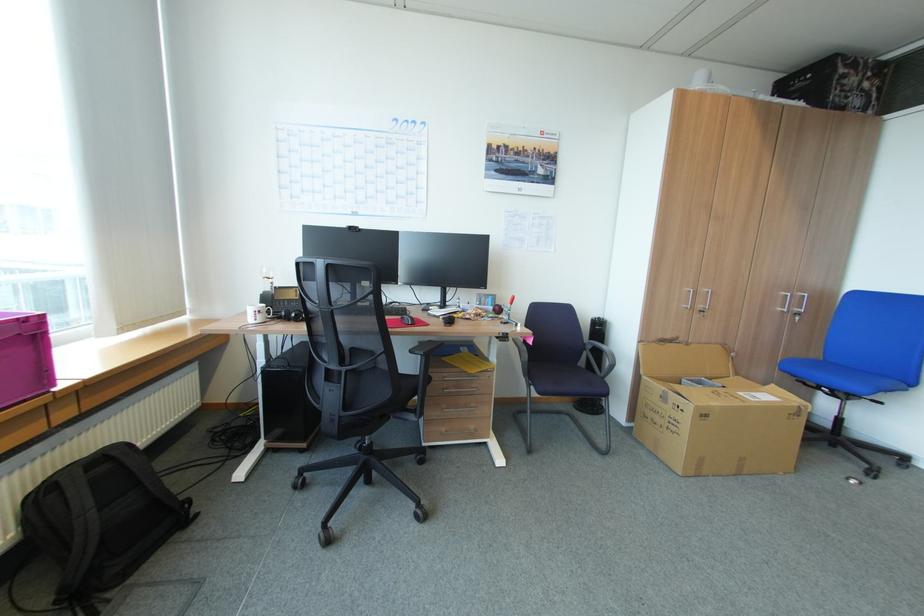
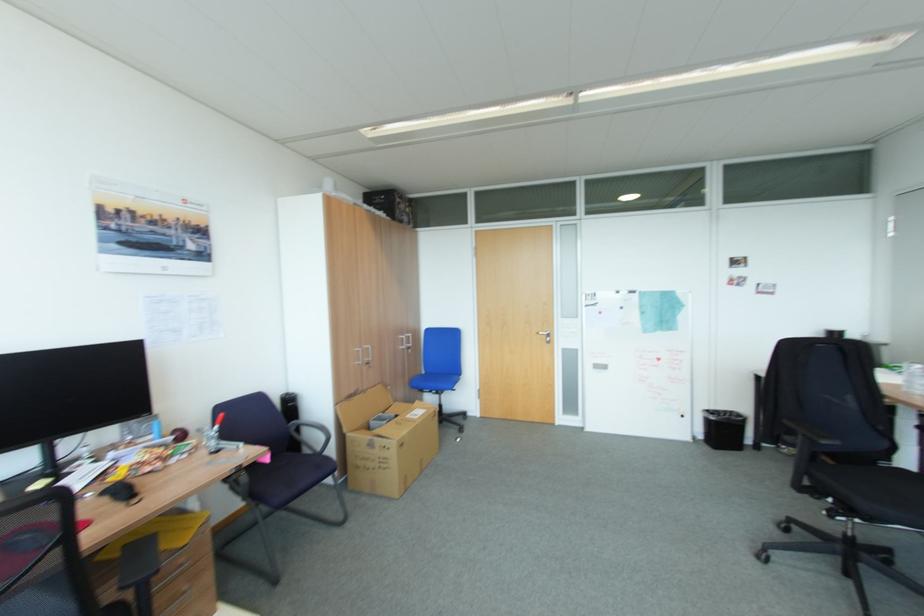
Locate, in the second image, the point that corresponds to pixel 704 306 in the first image.

(371, 360)